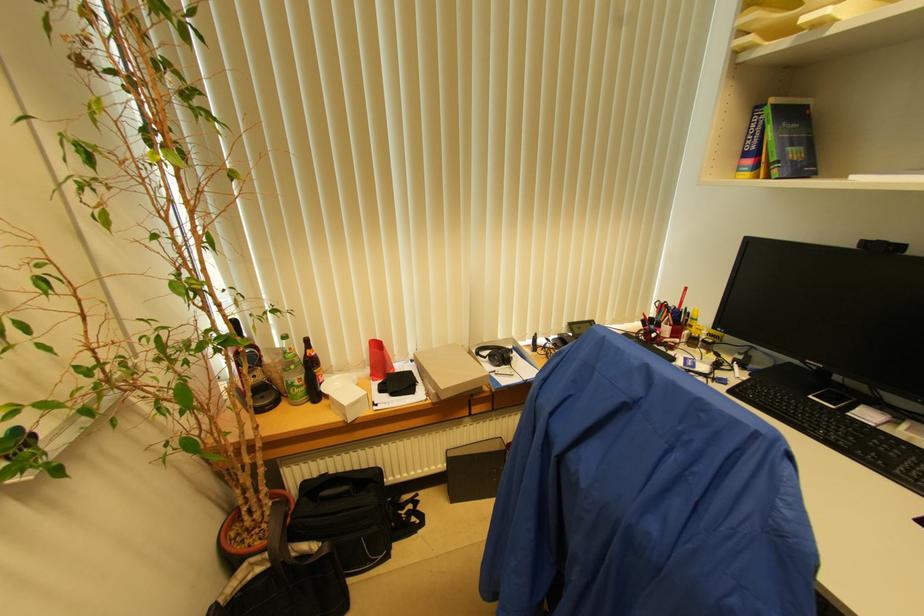
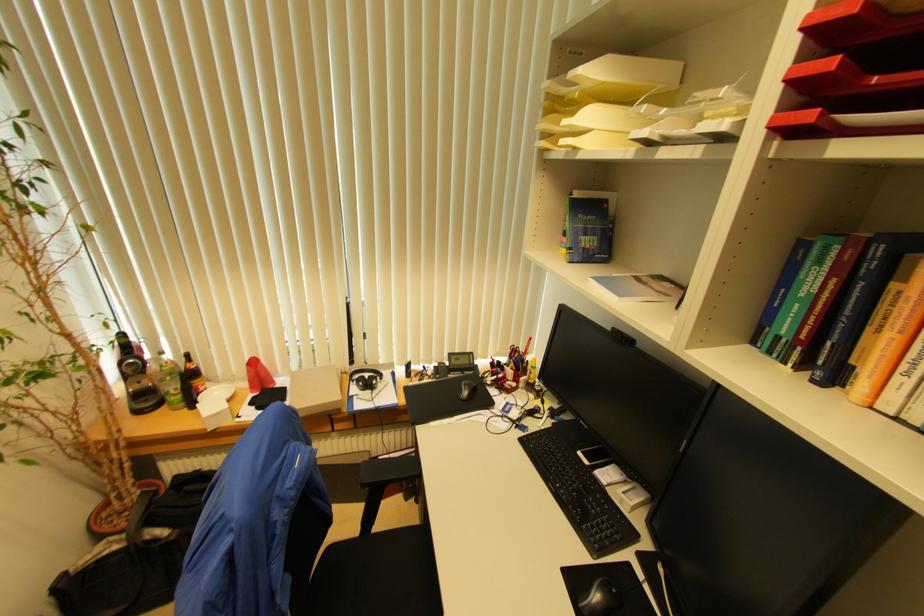
Locate, in the second image, the point that corresponds to the point at 298,386 in the first image.

(174, 394)